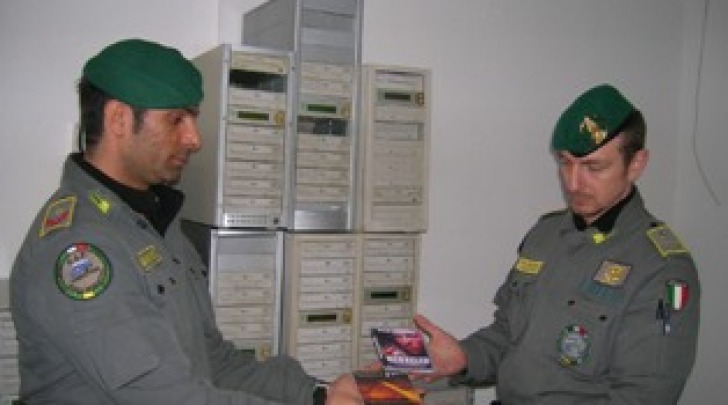
Identify the location of cd case. (395, 351).